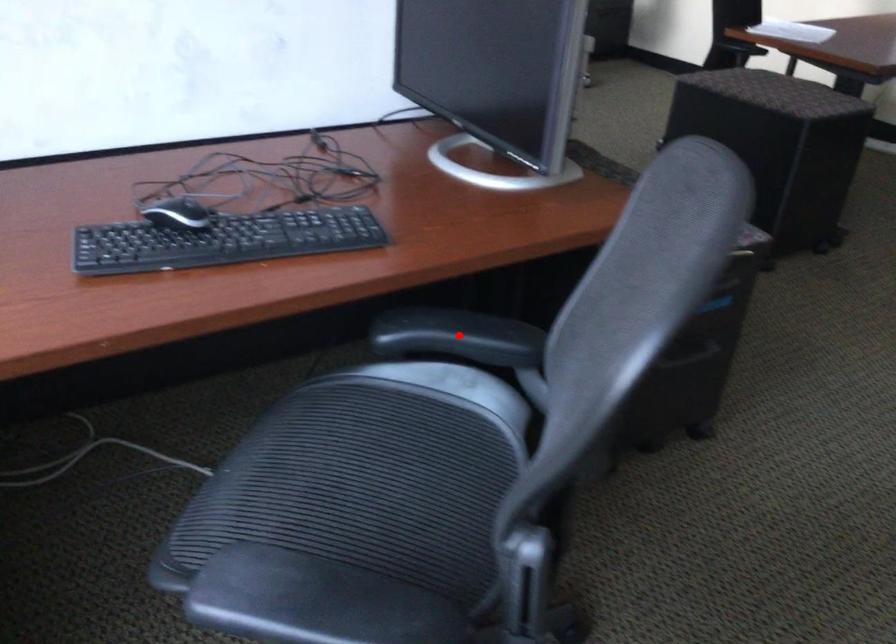
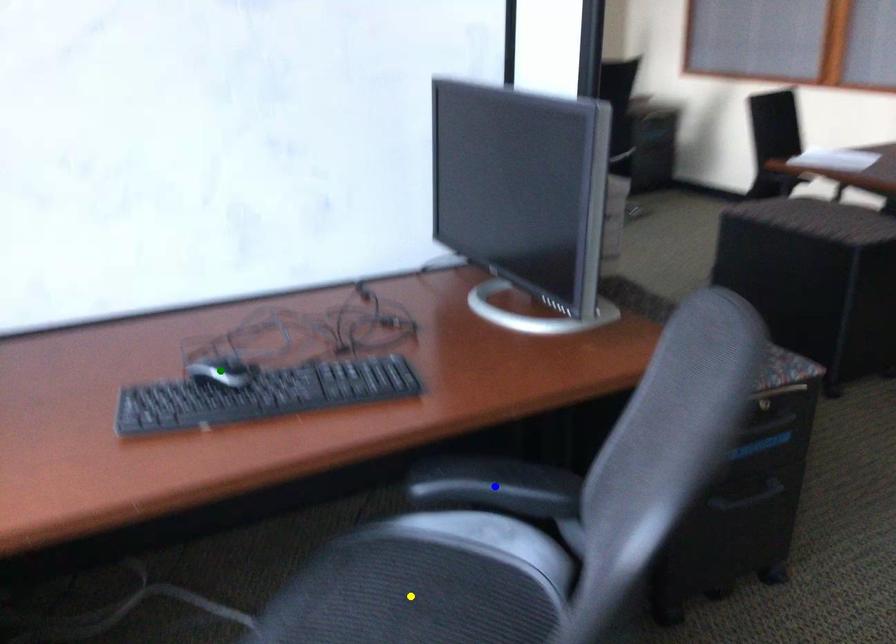
Question: I am providing you with two images of the same scene from different viewpoints. A red point is marked on the first image. You are given multiple points on the second image. Which point in image 2 is actually the same real-world point as the red point in image 1?

Choices:
 (A) green point
 (B) yellow point
 (C) blue point

Answer: (C)